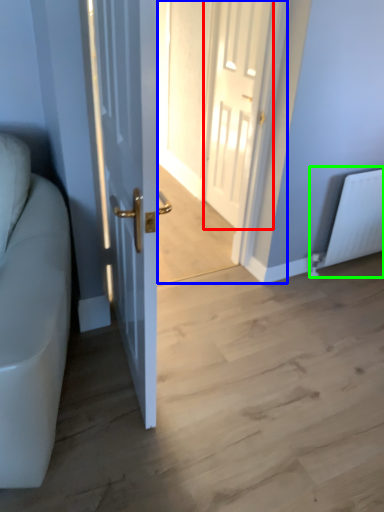
Question: Which object is the closest to the door (highlighted by a red box)? Choose among these: glass door (highlighted by a blue box) or radiator (highlighted by a green box).

Choices:
 (A) glass door
 (B) radiator

Answer: (A)